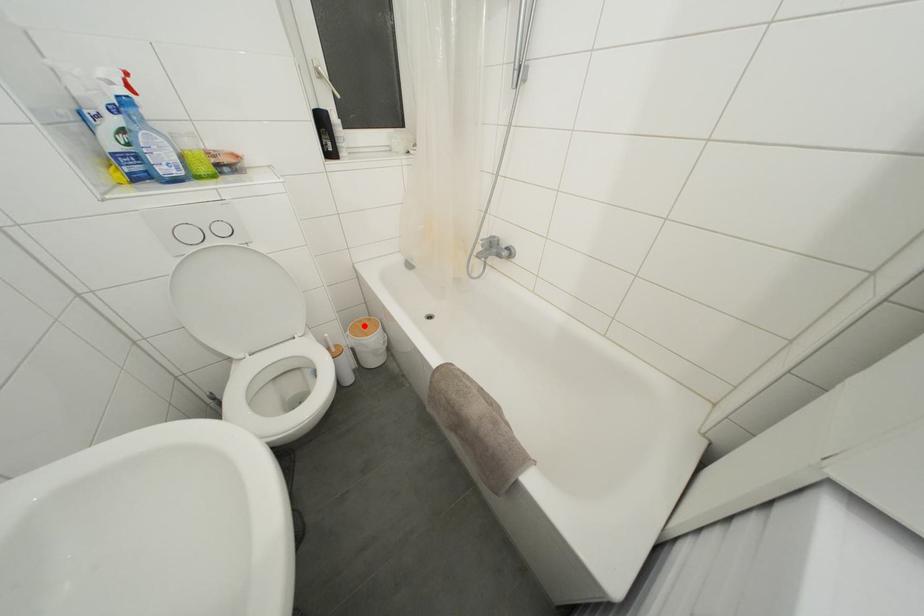
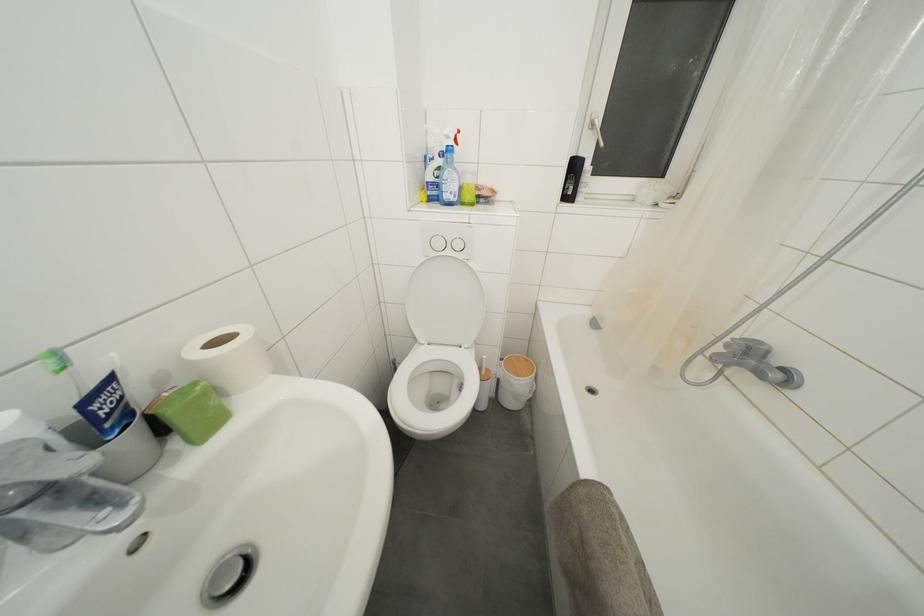
The point at the highlighted location is marked in the first image. Where is the corresponding point in the second image?

(521, 362)